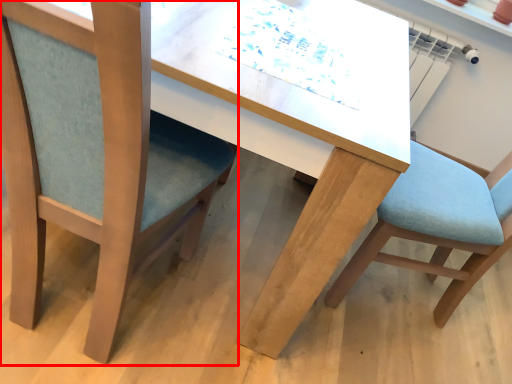
Question: From the image, what is the correct spatial relationship of chair (annotated by the red box) in relation to chair?

Choices:
 (A) right
 (B) left

Answer: (B)